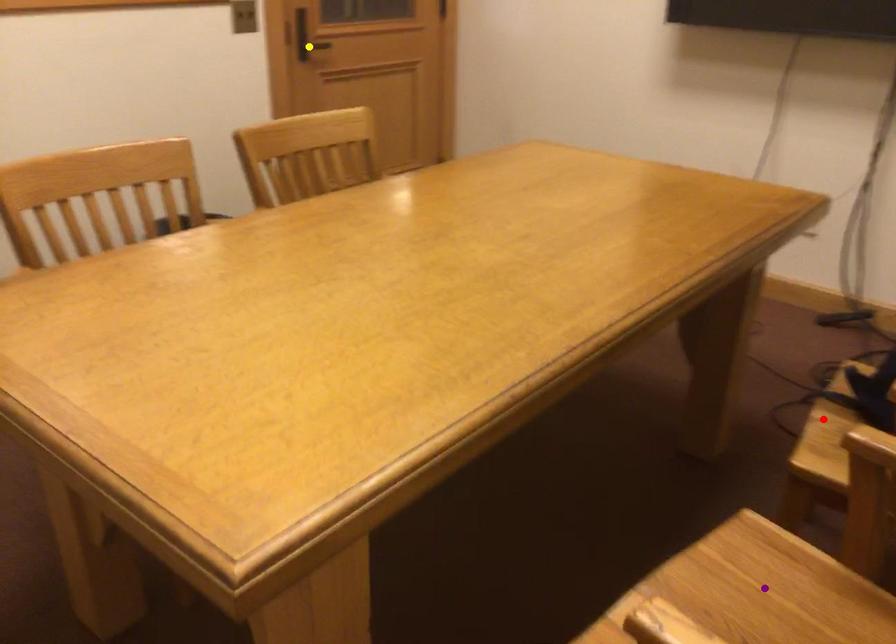
Order these from nearest to farthest:
yellow point | purple point | red point

1. purple point
2. red point
3. yellow point